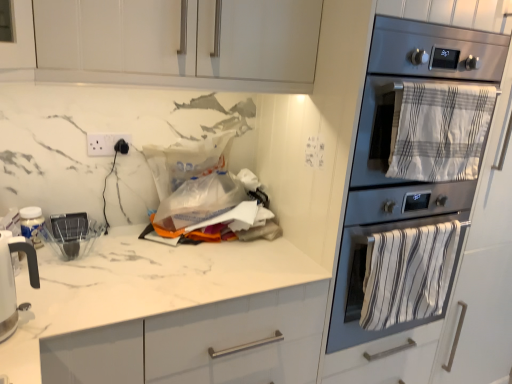
Question: Is stainless steel oven at right wider or thinner than white glossy electric kettle at left?

Choices:
 (A) wide
 (B) thin

Answer: (A)

Question: In terms of height, does stainless steel oven at right look taller or shorter compared to white glossy electric kettle at left?

Choices:
 (A) tall
 (B) short

Answer: (A)

Question: Estimate the real-world distances between objects in this image. Which object is closer to the white striped towel at right, which is the 2th blanket from bottom to top?

Choices:
 (A) white glossy cabinet at upper center
 (B) white plastic electric outlet at upper left
 (C) white striped towel at right, which appears as the second blanket when viewed from the top
 (D) white marble countertop at center
 (E) white glossy electric kettle at left

Answer: (C)

Question: Estimate the real-world distances between objects in this image. Which object is closer to the white striped towel at right, placed as the first blanket when sorted from bottom to top?

Choices:
 (A) white marble countertop at center
 (B) white glossy electric kettle at left
 (C) stainless steel oven at right
 (D) white striped towel at right, which is the 2th blanket from bottom to top
 (E) white plastic electric outlet at upper left

Answer: (C)